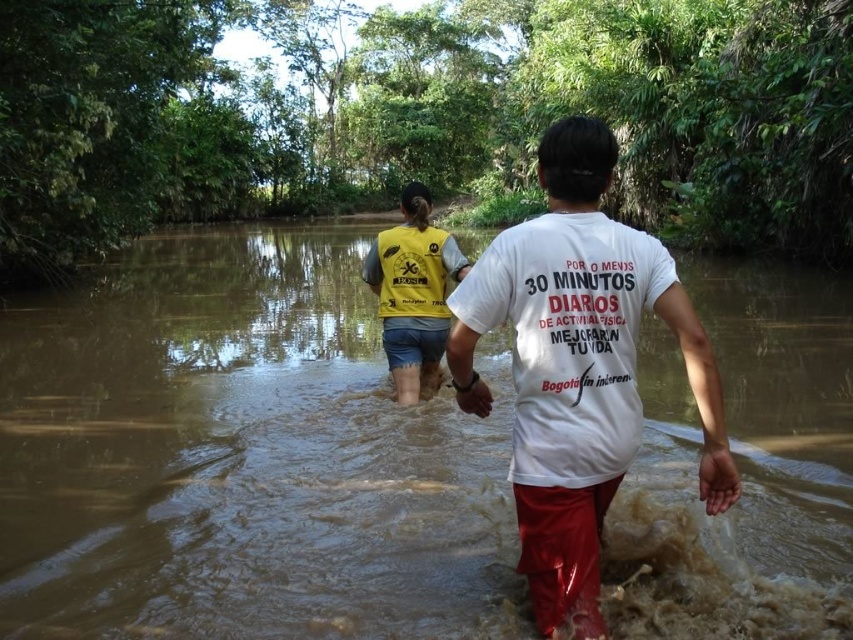
Based on the scene description, can the yellow fabric vest at center fit into the brown muddy water at center without overlapping its edges?

The brown muddy water at center is wider than the yellow fabric vest at center, so the vest can fit into the water without overlapping its edges.